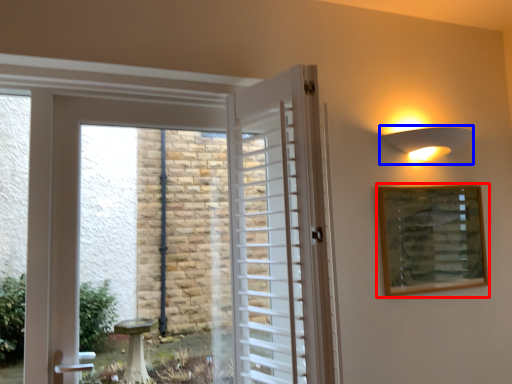
Question: Among these objects, which one is nearest to the camera, picture frame (highlighted by a red box) or light fixture (highlighted by a blue box)?

Choices:
 (A) picture frame
 (B) light fixture

Answer: (B)